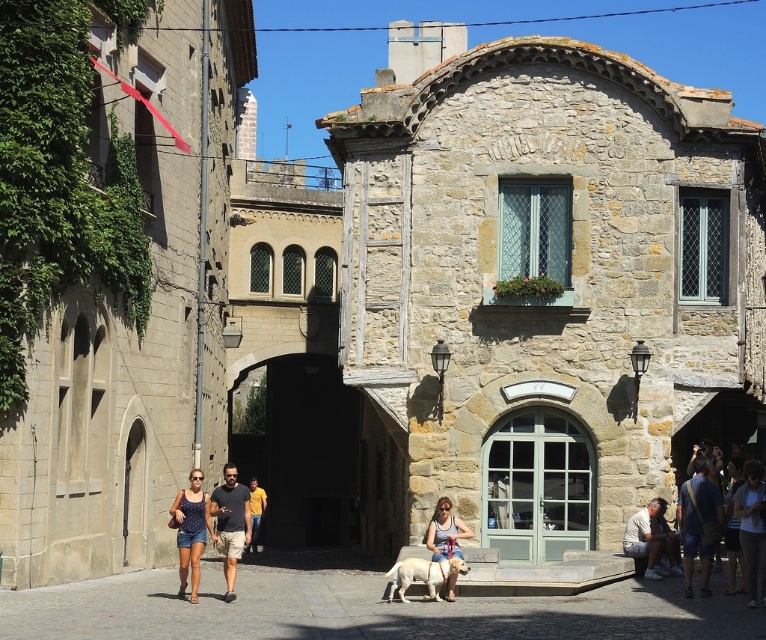
Question: Considering the relative positions of white stone dog at center and tan cotton shorts at lower left in the image provided, where is white stone dog at center located with respect to tan cotton shorts at lower left?

Choices:
 (A) below
 (B) above

Answer: (A)

Question: Is the position of white stone dog at center more distant than that of blue denim shorts at lower left?

Choices:
 (A) yes
 (B) no

Answer: (B)

Question: Which point is closer to the camera?

Choices:
 (A) blue denim shorts at lower right
 (B) white stone dog at center

Answer: (B)

Question: Is blue denim shorts at lower right thinner than blue denim shorts at lower left?

Choices:
 (A) yes
 (B) no

Answer: (A)

Question: Which point is closer to the camera?

Choices:
 (A) light blue denim shorts at lower right
 (B) matte blue shirt at center
 (C) yellow cotton shirt at center

Answer: (A)

Question: Which object is closer to the camera taking this photo?

Choices:
 (A) white stone dog at center
 (B) tan cotton shorts at lower left
 (C) white fur dog at center
 (D) light blue denim shorts at lower right

Answer: (A)